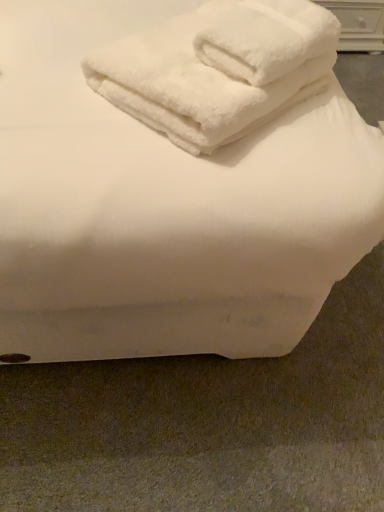
Question: Does white fluffy towels at upper center lie behind white wood drawer at upper right?

Choices:
 (A) yes
 (B) no

Answer: (B)

Question: From a real-world perspective, is white fluffy towels at upper center located higher than white wood drawer at upper right?

Choices:
 (A) no
 (B) yes

Answer: (B)

Question: Could you tell me if white fluffy towels at upper center is facing white wood drawer at upper right?

Choices:
 (A) yes
 (B) no

Answer: (B)

Question: Does white fluffy towels at upper center appear on the left side of white wood drawer at upper right?

Choices:
 (A) no
 (B) yes

Answer: (B)

Question: Considering the relative positions of white fluffy towels at upper center and white wood drawer at upper right in the image provided, is white fluffy towels at upper center to the right of white wood drawer at upper right from the viewer's perspective?

Choices:
 (A) no
 (B) yes

Answer: (A)

Question: Is white fluffy towels at upper center closer to camera compared to white wood drawer at upper right?

Choices:
 (A) yes
 (B) no

Answer: (A)

Question: Is the position of white wood drawer at upper right more distant than that of white fluffy towels at upper center?

Choices:
 (A) yes
 (B) no

Answer: (A)

Question: From a real-world perspective, is white wood drawer at upper right physically below white fluffy towels at upper center?

Choices:
 (A) yes
 (B) no

Answer: (A)

Question: Considering the relative sizes of white wood drawer at upper right and white fluffy towels at upper center in the image provided, is white wood drawer at upper right shorter than white fluffy towels at upper center?

Choices:
 (A) yes
 (B) no

Answer: (B)

Question: From the image's perspective, is white wood drawer at upper right located beneath white fluffy towels at upper center?

Choices:
 (A) no
 (B) yes

Answer: (A)

Question: From the image's perspective, does white wood drawer at upper right appear higher than white fluffy towels at upper center?

Choices:
 (A) no
 (B) yes

Answer: (B)

Question: Is the position of white wood drawer at upper right less distant than that of white fluffy towels at upper center?

Choices:
 (A) yes
 (B) no

Answer: (B)

Question: Is white wood drawer at upper right inside the boundaries of white fluffy towels at upper center, or outside?

Choices:
 (A) inside
 (B) outside

Answer: (B)